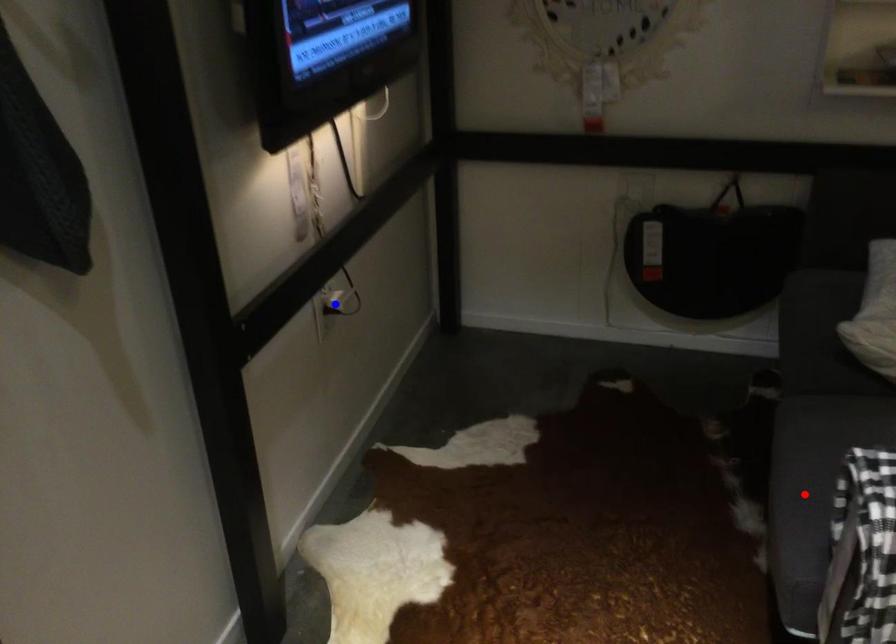
Question: In the image, two points are highlighted. Which point is nearer to the camera? Reply with the corresponding letter.

Choices:
 (A) blue point
 (B) red point

Answer: (B)